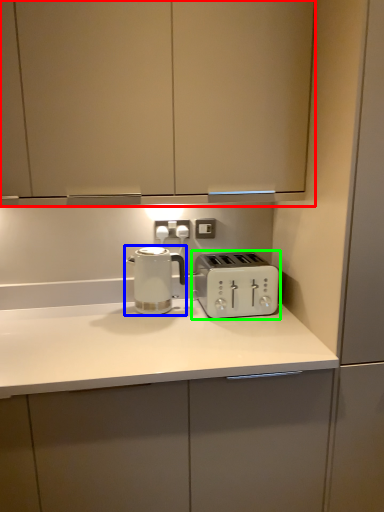
Question: Estimate the real-world distances between objects in this image. Which object is closer to cabinetry (highlighted by a red box), kettle (highlighted by a blue box) or toaster (highlighted by a green box)?

Choices:
 (A) kettle
 (B) toaster

Answer: (A)